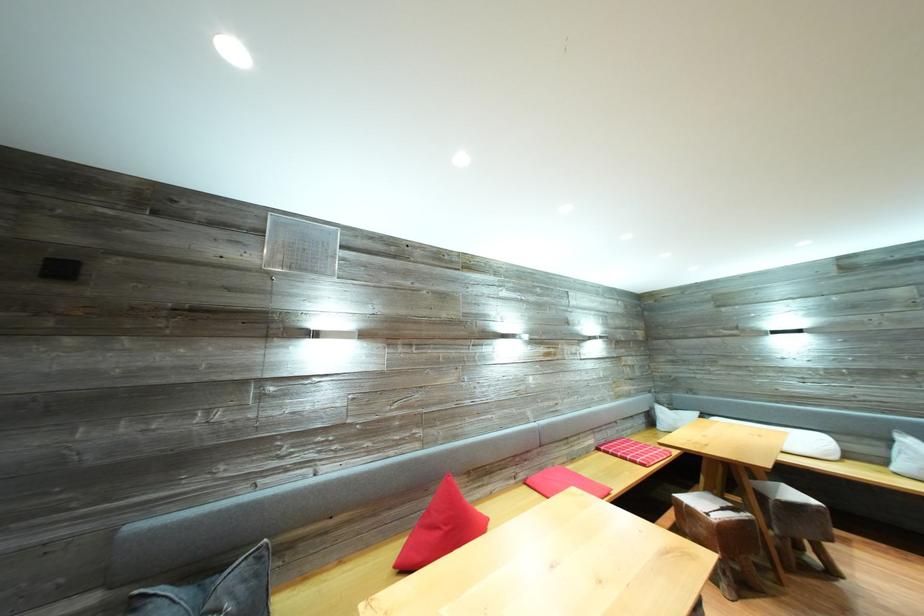
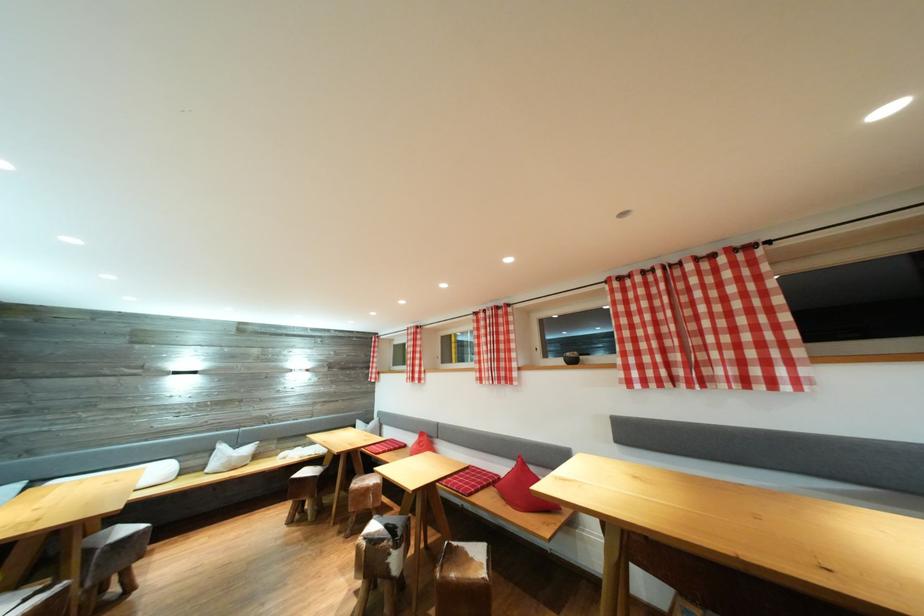
Find the pixel in the second image that matches point (798, 500) in the first image.

(131, 536)